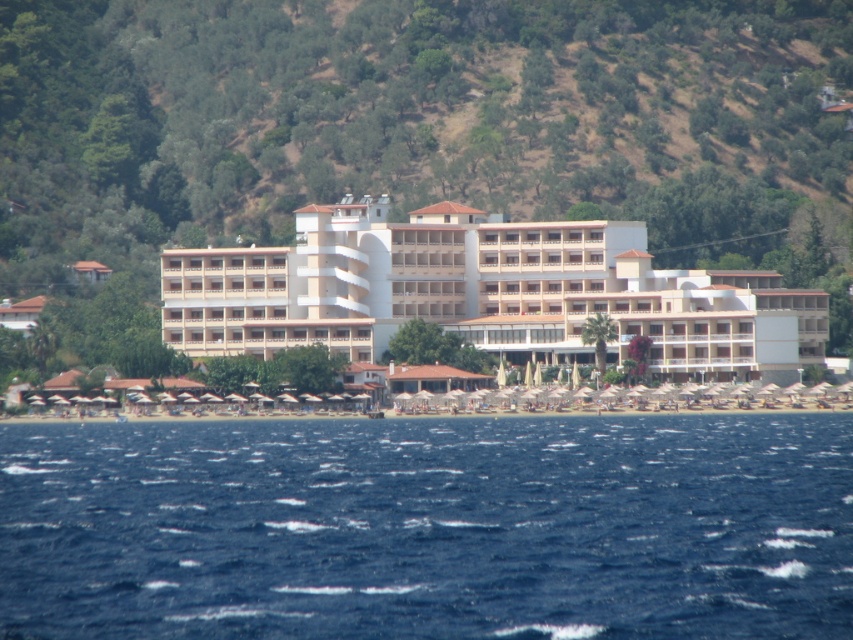
You are a photographer planning to capture a wide shot of the coastal scene. You want to ensure that both the blue water at lower center and the white matte building at center are visible in the frame. Based on their relative sizes, which object will occupy more of the horizontal space in your photograph?

The blue water at lower center will occupy more horizontal space because its width is larger than that of the white matte building at center.

You are standing on the beach and want to take a photo of the white matte building at center while including the blue water at lower center in the frame. Based on their positions, which direction should you move to ensure both are visible?

You should move to the right so that the white matte building at center is to the right of the blue water at lower center in your frame.

You are a visitor standing on the beach and want to take a photo of the white matte building at center without the blue water at lower center appearing in the frame. How should you adjust your camera angle?

To avoid including the blue water at lower center in the photo, you should tilt your camera upward so that the white matte building at center fills the frame while the blue water at lower center is positioned below the frame.